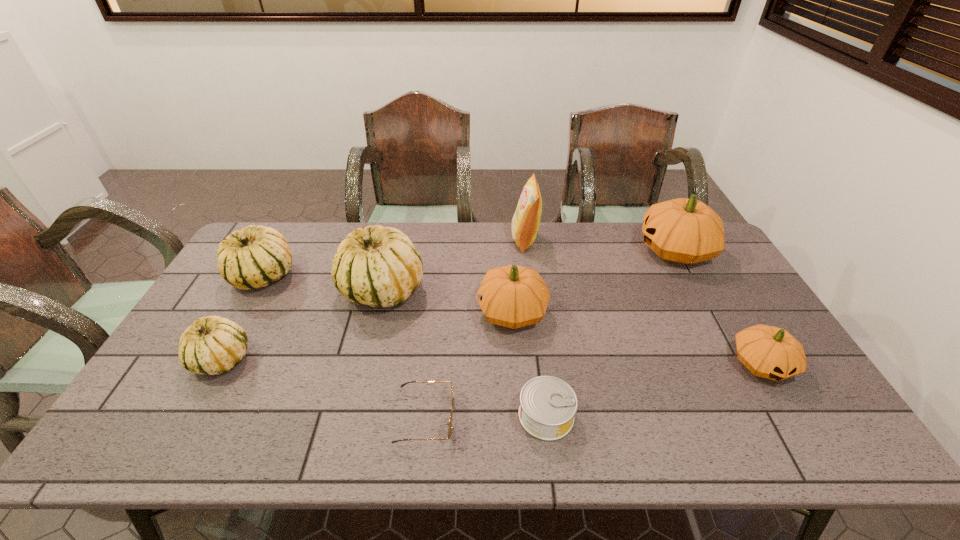
You are a GUI agent. You are given a task and a screenshot of the screen. Output one action in this format:
    pyautogui.click(x=<x>, y=<y>)
    Task: Click on the gray sunglasses
    The width and height of the screenshot is (960, 540).
    Given the screenshot: What is the action you would take?
    pyautogui.click(x=451, y=413)

Where is `vacant space situated on the front-facing side of the crisp (potato chip)`? The height and width of the screenshot is (540, 960). vacant space situated on the front-facing side of the crisp (potato chip) is located at coordinates (419, 240).

In order to click on vacant space located on the front-facing side of the crisp (potato chip) in this screenshot , I will do `click(411, 240)`.

The width and height of the screenshot is (960, 540). I want to click on vacant space located 0.300m on the front-facing side of the crisp (potato chip), so click(427, 240).

I want to click on vacant space located 0.240m on the side of the biggest orange gourd with the carved face, so click(x=567, y=251).

What are the coordinates of `vacant space located 0.130m on the side of the biggest orange gourd with the carved face` in the screenshot? It's located at (599, 251).

You are a GUI agent. You are given a task and a screenshot of the screen. Output one action in this format:
    pyautogui.click(x=<x>, y=<y>)
    Task: Click on the vacant region located on the side of the biggest orange gourd with the carved face
    The width and height of the screenshot is (960, 540).
    Given the screenshot: What is the action you would take?
    pyautogui.click(x=530, y=251)

This screenshot has height=540, width=960. Find the location of `vacant area situated 0.230m on the right of the rightmost white gourd`. vacant area situated 0.230m on the right of the rightmost white gourd is located at coordinates click(499, 291).

Identify the location of vacant space positioned 0.290m on the side of the second biggest orange gourd with the carved face. This screenshot has height=540, width=960. (377, 312).

Where is `free spot located 0.140m on the side of the second biggest orange gourd with the carved face`? This screenshot has width=960, height=540. free spot located 0.140m on the side of the second biggest orange gourd with the carved face is located at coordinates (428, 312).